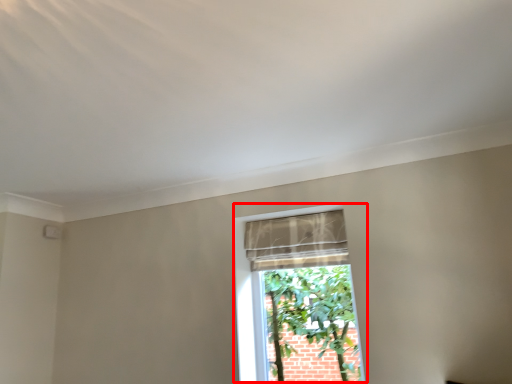
Question: From the image's perspective, considering the relative positions of window (annotated by the red box) and curtain in the image provided, where is window (annotated by the red box) located with respect to the staircase?

Choices:
 (A) above
 (B) below

Answer: (B)